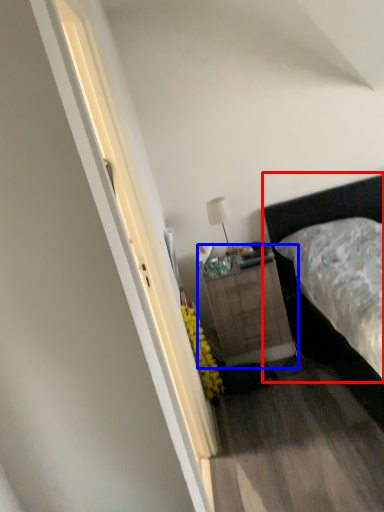
Question: Among these objects, which one is nearest to the camera, bed (highlighted by a red box) or nightstand (highlighted by a blue box)?

Choices:
 (A) bed
 (B) nightstand

Answer: (A)